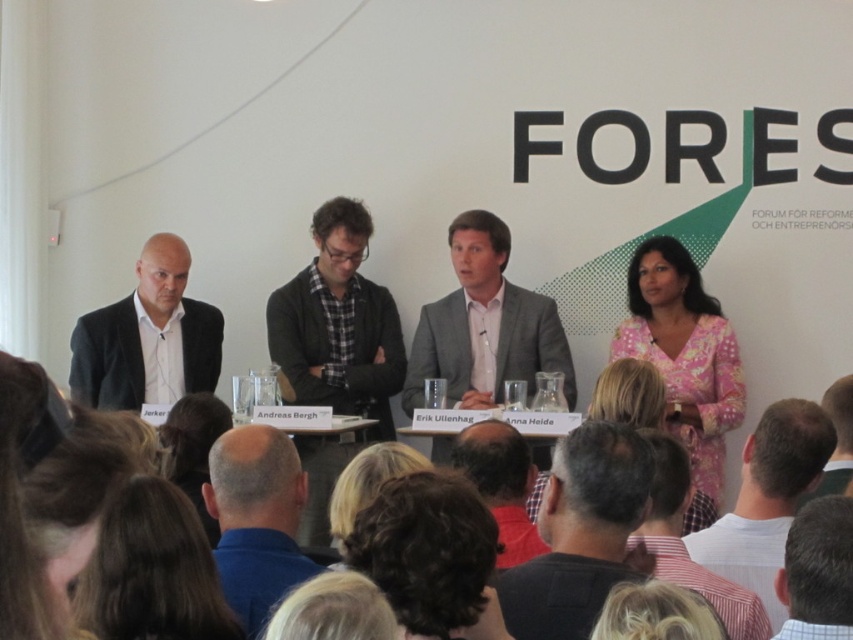
Question: Is pink floral dress at right positioned before dark brown hair at lower center?

Choices:
 (A) no
 (B) yes

Answer: (A)

Question: Does light gray suit at center appear on the left side of light brown hair at center?

Choices:
 (A) no
 (B) yes

Answer: (B)

Question: Which object is positioned farthest from the brown hair at lower right?

Choices:
 (A) dark gray sweater at center
 (B) dark blue shirt at center
 (C) pink floral dress at right
 (D) matte black suit at left

Answer: (D)

Question: Is matte black suit at left smaller than dark blue shirt at center?

Choices:
 (A) no
 (B) yes

Answer: (A)

Question: Which object appears closest to the camera in this image?

Choices:
 (A) dark brown curly hair at lower center
 (B) dark gray sweater at center
 (C) dark blue shirt at center

Answer: (A)

Question: Which object appears closest to the camera in this image?

Choices:
 (A) bald head at lower center
 (B) dark blue shirt at center
 (C) light brown hair at center

Answer: (A)